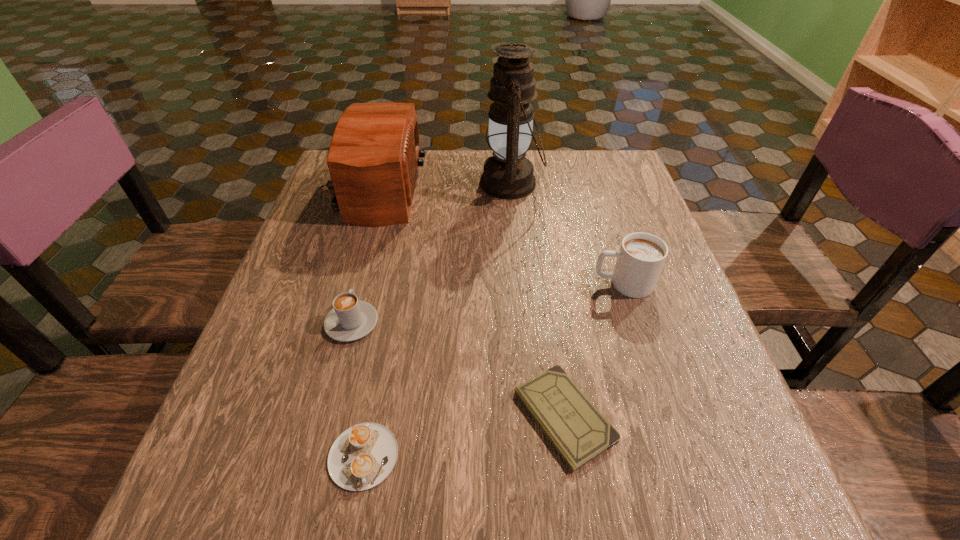
Identify the location of the tallest object. The width and height of the screenshot is (960, 540). click(507, 174).

Locate an element on the screen. The height and width of the screenshot is (540, 960). radio receiver is located at coordinates (373, 160).

At what (x,y) coordinates should I click in order to perform the action: click on the rightmost cappuccino. Please return your answer as a coordinate pair (x, y). Looking at the image, I should click on (640, 259).

This screenshot has width=960, height=540. What are the coordinates of `the third farthest object` in the screenshot? It's located at (640, 259).

Find the location of a particular element. the third shortest object is located at coordinates (350, 319).

This screenshot has height=540, width=960. I want to click on the third nearest object, so click(350, 319).

Find the location of a particular element. The width and height of the screenshot is (960, 540). the shortest cappuccino is located at coordinates (362, 456).

Image resolution: width=960 pixels, height=540 pixels. I want to click on the nearest cappuccino, so click(362, 456).

At what (x,y) coordinates should I click in order to perform the action: click on checkbook. Please return your answer as a coordinate pair (x, y). Looking at the image, I should click on (579, 432).

What are the coordinates of `vacant space located 0.270m on the left of the oil lamp` in the screenshot? It's located at (380, 184).